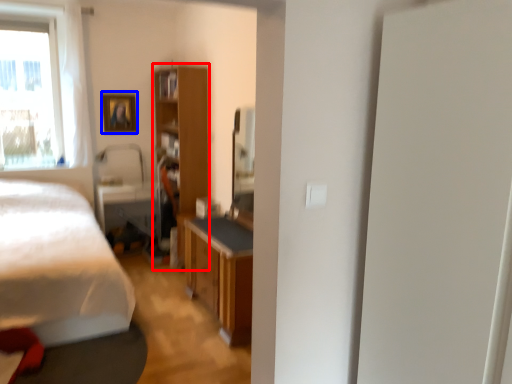
Question: Among these objects, which one is farthest to the camera, cabinetry (highlighted by a red box) or picture frame (highlighted by a blue box)?

Choices:
 (A) cabinetry
 (B) picture frame

Answer: (B)